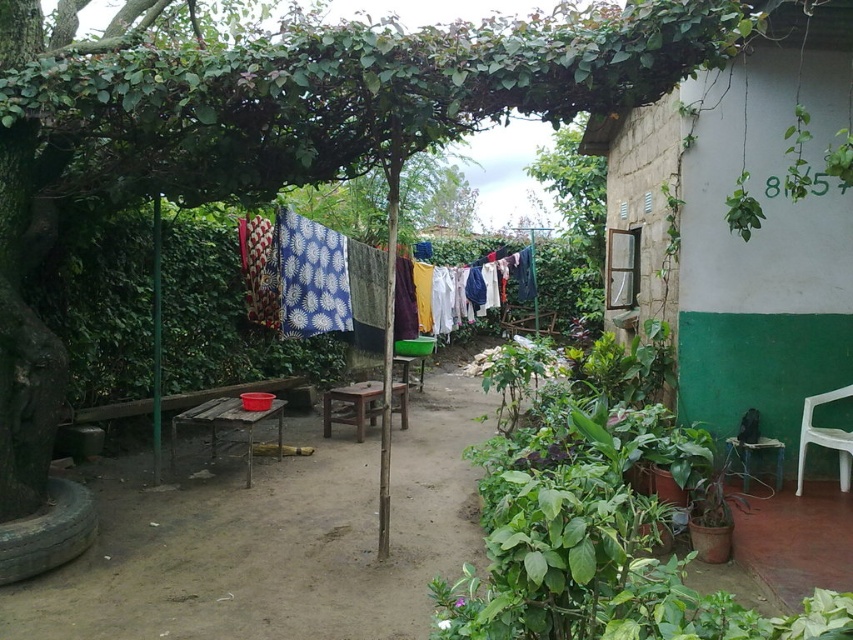
Which is below, dull wood table at center or printed fabric clothes at center?

Positioned lower is dull wood table at center.

Can you confirm if dull wood table at center is taller than printed fabric clothes at center?

No.

The height and width of the screenshot is (640, 853). In order to click on dull wood table at center in this screenshot , I will do `click(274, 538)`.

Does point (802, 323) come behind point (331, 316)?

No, (802, 323) is closer to viewer.

Based on the photo, who is taller, green concrete wall at right or printed fabric clothes at center?

green concrete wall at right is taller.

Find the location of a particular element. green concrete wall at right is located at coordinates (752, 230).

Describe the element at coordinates (274, 538) in the screenshot. I see `dull wood table at center` at that location.

From the picture: Can you confirm if dull wood table at center is positioned above green concrete wall at right?

Incorrect, dull wood table at center is not positioned above green concrete wall at right.

Which is behind, point (283, 604) or point (769, 108)?

Point (769, 108)

Where is `dull wood table at center`? This screenshot has height=640, width=853. dull wood table at center is located at coordinates (274, 538).